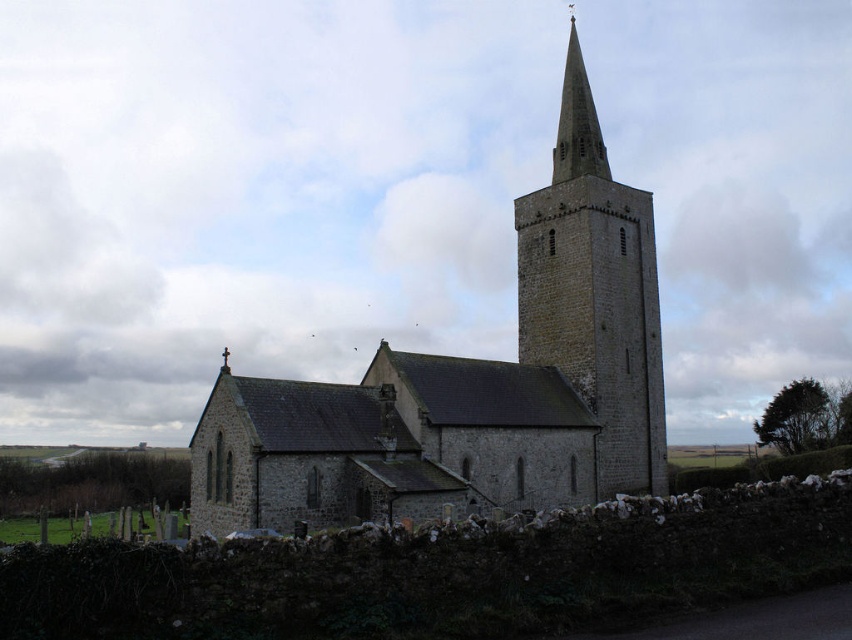
Question: Can you confirm if stone church at center is smaller than stone steeple at center?

Choices:
 (A) no
 (B) yes

Answer: (A)

Question: Observing the image, what is the correct spatial positioning of stone church at center in reference to stone steeple at center?

Choices:
 (A) below
 (B) above

Answer: (A)

Question: Which object appears farthest from the camera in this image?

Choices:
 (A) smooth stone spire at upper center
 (B) stone church at center

Answer: (A)

Question: Which object is closer to the camera taking this photo?

Choices:
 (A) smooth stone spire at upper center
 (B) stone steeple at center

Answer: (B)

Question: Among these objects, which one is farthest from the camera?

Choices:
 (A) smooth stone spire at upper center
 (B) stone church at center

Answer: (A)

Question: In this image, where is stone church at center located relative to smooth stone spire at upper center?

Choices:
 (A) below
 (B) above

Answer: (A)